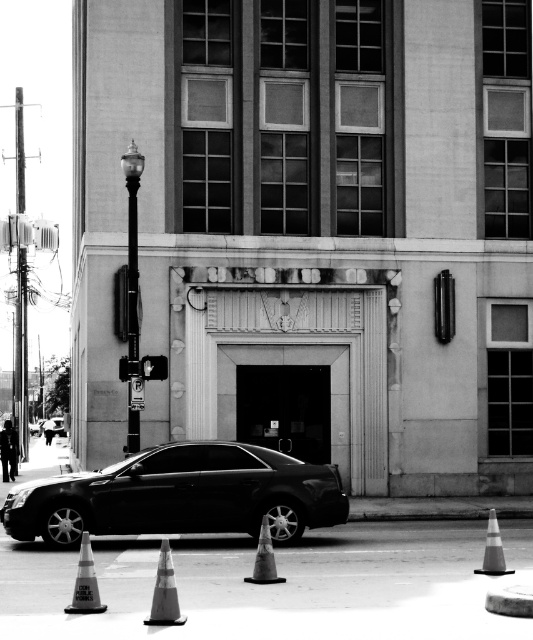
Question: Is orange reflective traffic cone at lower center positioned before reflective orange cone at lower right?

Choices:
 (A) yes
 (B) no

Answer: (A)

Question: Which point is farther to the camera?

Choices:
 (A) reflective orange cone at lower right
 (B) smooth gray cone at center
 (C) orange reflective traffic cone at lower center

Answer: (A)

Question: Can you confirm if shiny black sedan at center is smaller than reflective orange cone at lower right?

Choices:
 (A) yes
 (B) no

Answer: (A)

Question: Is orange reflective traffic cone at lower center smaller than smooth gray cone at center?

Choices:
 (A) yes
 (B) no

Answer: (A)

Question: Which point is closer to the camera taking this photo?

Choices:
 (A) (312, 476)
 (B) (76, 580)
 (C) (270, 541)
 (D) (173, 620)

Answer: (D)

Question: Which point is closer to the camera taking this photo?

Choices:
 (A) (157, 611)
 (B) (502, 561)

Answer: (A)